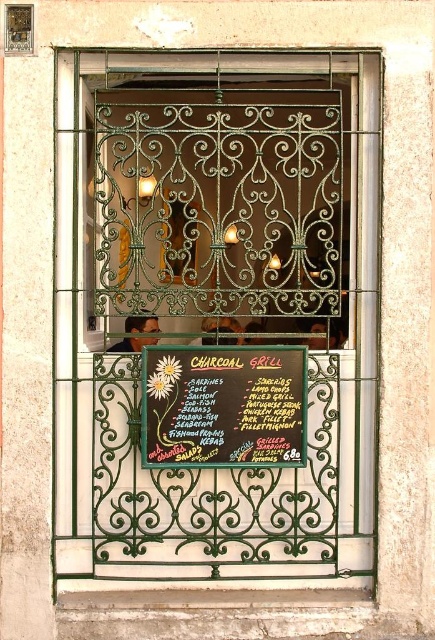
Question: Is green wrought iron grill at center bigger than black chalkboard at center?

Choices:
 (A) no
 (B) yes

Answer: (B)

Question: Which of the following is the farthest from the observer?

Choices:
 (A) (297, 176)
 (B) (218, 460)
 (C) (180, 396)

Answer: (A)

Question: Considering the real-world distances, which object is closest to the green wrought iron at center?

Choices:
 (A) green wrought iron grill at center
 (B) black chalkboard at center

Answer: (A)

Question: Does green wrought iron at center appear on the left side of black chalkboard at center?

Choices:
 (A) yes
 (B) no

Answer: (B)

Question: Is green wrought iron grill at center bigger than black chalkboard at center?

Choices:
 (A) yes
 (B) no

Answer: (A)

Question: Estimate the real-world distances between objects in this image. Which object is closer to the green wrought iron grill at center?

Choices:
 (A) green wrought iron at center
 (B) black chalkboard at center

Answer: (A)